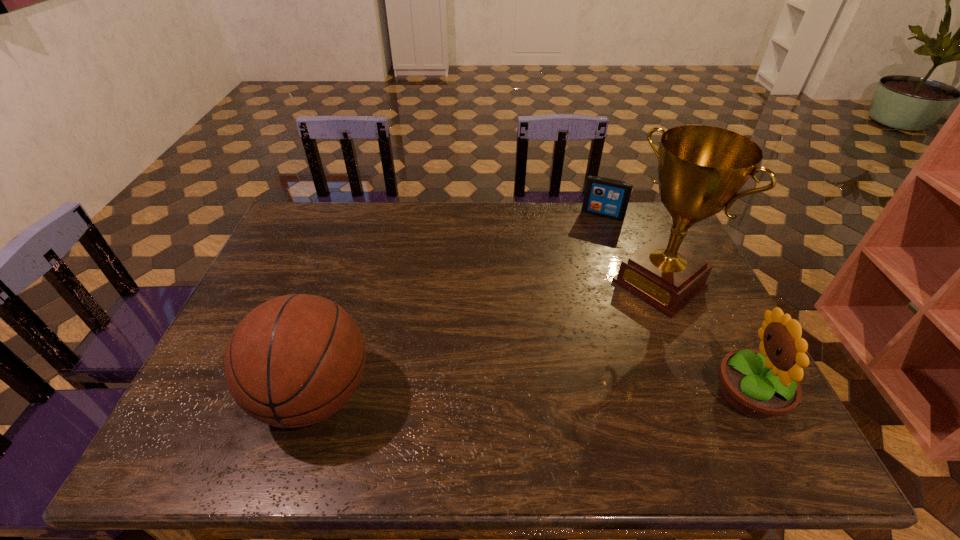
The width and height of the screenshot is (960, 540). Identify the location of sunflower that is at the near edge. (762, 384).

Find the location of `object that is at the left edge`. object that is at the left edge is located at coordinates (293, 361).

Where is `sunflower that is at the right edge`? sunflower that is at the right edge is located at coordinates (762, 384).

The width and height of the screenshot is (960, 540). Identify the location of award present at the right edge. (701, 169).

The image size is (960, 540). I want to click on object located at the near left corner, so click(x=293, y=361).

Identify the location of object positioned at the near right corner. (762, 384).

In the image, there is a desktop. Identify the location of free space at the far edge. The width and height of the screenshot is (960, 540). (350, 228).

Locate an element on the screen. This screenshot has width=960, height=540. vacant area at the near edge is located at coordinates (389, 400).

Locate an element on the screen. The width and height of the screenshot is (960, 540). free space at the right edge of the desktop is located at coordinates (724, 321).

In the image, there is a desktop. In order to click on blank space at the far left corner in this screenshot , I will do `click(315, 235)`.